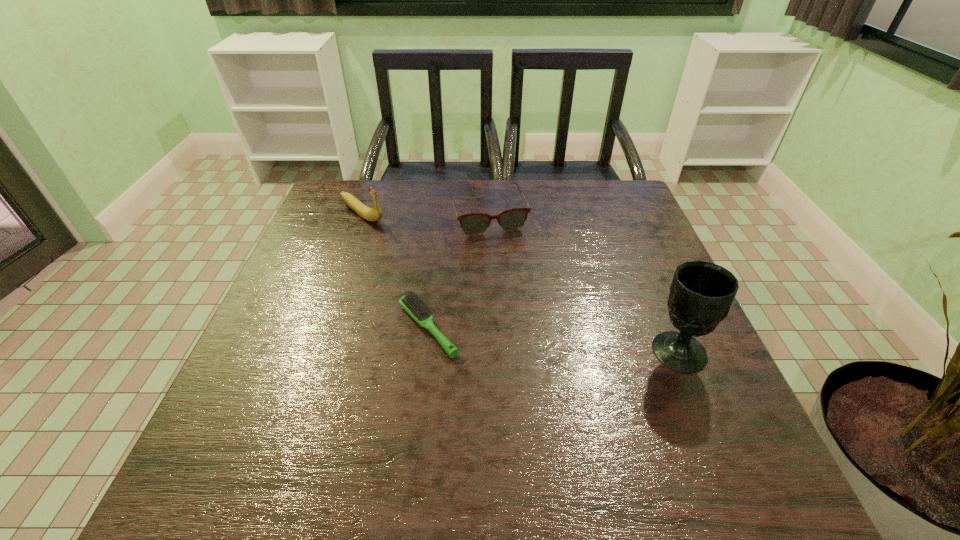
The height and width of the screenshot is (540, 960). I want to click on free space that is in between the chalice and the spectacles, so click(x=583, y=283).

Where is `unoccupied area between the banana and the hairbrush`? unoccupied area between the banana and the hairbrush is located at coordinates (x=396, y=271).

This screenshot has height=540, width=960. Identify the location of free space between the chalice and the leftmost object. (520, 282).

The height and width of the screenshot is (540, 960). Find the location of `vacant point located between the shortest object and the rightmost object`. vacant point located between the shortest object and the rightmost object is located at coordinates (553, 339).

In order to click on free spot between the second tallest object and the second shortest object in this screenshot , I will do `click(425, 214)`.

Identify the location of vacant space in between the third shortest object and the hairbrush. The height and width of the screenshot is (540, 960). point(396,271).

Identify which object is located as the nearest to the third tallest object. Please provide its 2D coordinates. Your answer should be formatted as a tuple, i.e. [(x, y)], where the tuple contains the x and y coordinates of a point satisfying the conditions above.

[(373, 214)]

Where is `the closest object relative to the hairbrush`? the closest object relative to the hairbrush is located at coordinates (512, 219).

Image resolution: width=960 pixels, height=540 pixels. Identify the location of blank area in the image that satisfies the following two spatial constraints: 1. on the back side of the shortest object; 2. on the right side of the second shortest object. (442, 215).

Identify the location of vacant region that satisfies the following two spatial constraints: 1. on the front side of the shortest object; 2. on the left side of the banana. The image size is (960, 540). (322, 328).